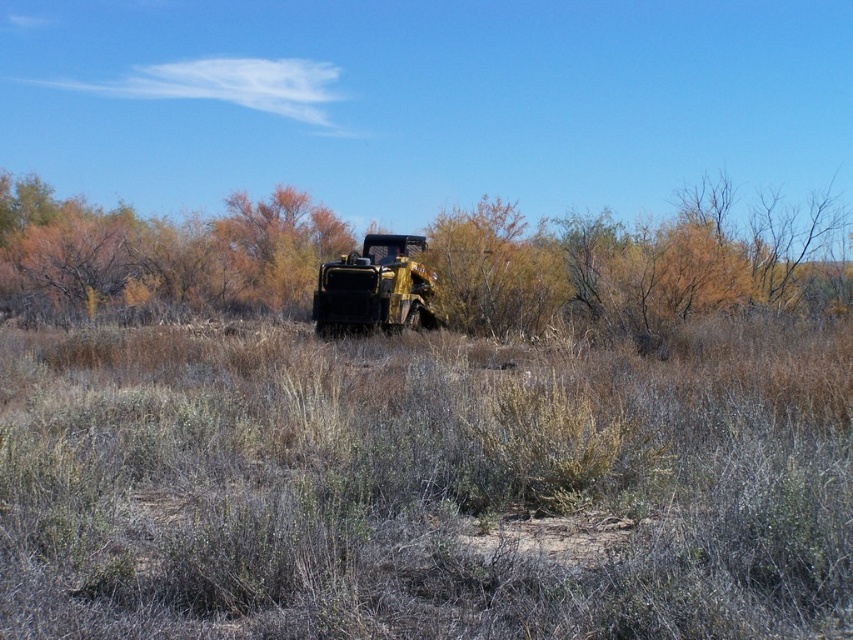
Question: Among these objects, which one is nearest to the camera?

Choices:
 (A) metallic yellow jeep at center
 (B) brown textured shrub at center
 (C) dry grass at center

Answer: (C)

Question: Which point is farther to the camera?

Choices:
 (A) dry grass at center
 (B) brown textured shrub at center

Answer: (B)

Question: Can you confirm if brown textured shrub at center is positioned below metallic yellow jeep at center?

Choices:
 (A) yes
 (B) no

Answer: (B)

Question: Is dry grass at center to the left of brown textured shrub at center from the viewer's perspective?

Choices:
 (A) no
 (B) yes

Answer: (A)

Question: Can you confirm if dry grass at center is positioned to the left of brown textured shrub at center?

Choices:
 (A) no
 (B) yes

Answer: (A)

Question: Which object is farther from the camera taking this photo?

Choices:
 (A) metallic yellow jeep at center
 (B) brown textured shrub at center
 (C) dry grass at center

Answer: (A)